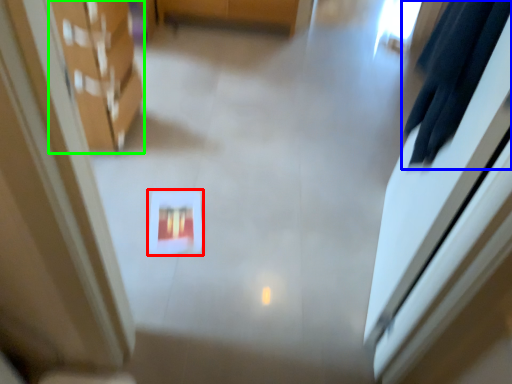
Question: Considering the real-world distances, which object is closest to square (highlighted by a red box)? robe (highlighted by a blue box) or furniture (highlighted by a green box).

Choices:
 (A) robe
 (B) furniture

Answer: (B)